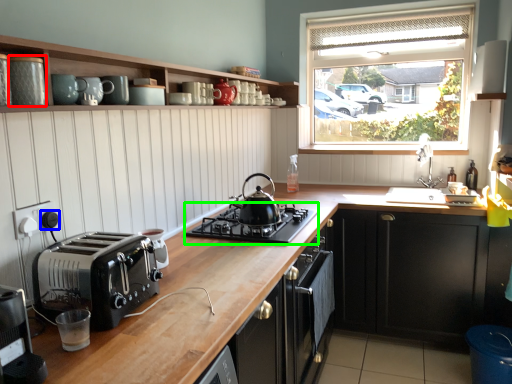
Question: Which object is the closest to the appliance (highlighted by a red box)? Choose among these: knob (highlighted by a blue box) or gas stove (highlighted by a green box).

Choices:
 (A) knob
 (B) gas stove

Answer: (A)